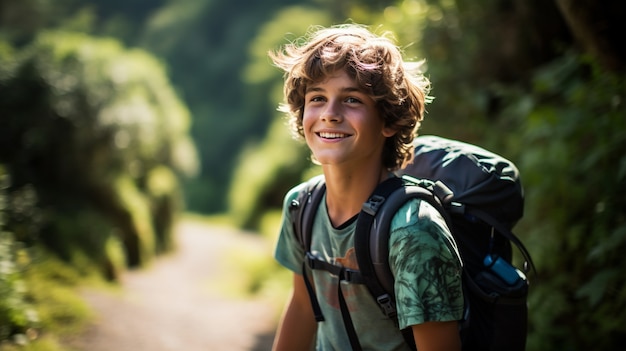
Image resolution: width=626 pixels, height=351 pixels. I want to click on bottle, so click(506, 268).